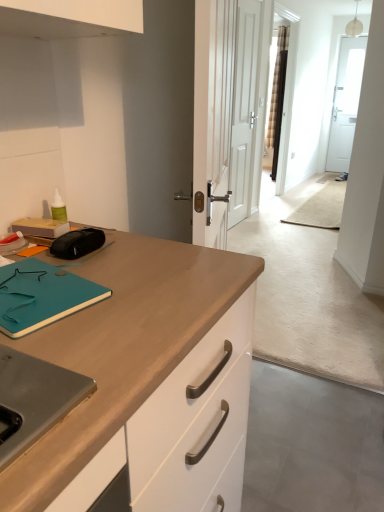
I want to click on free space above teal matte notepad at left (from a real-world perspective), so click(x=39, y=284).